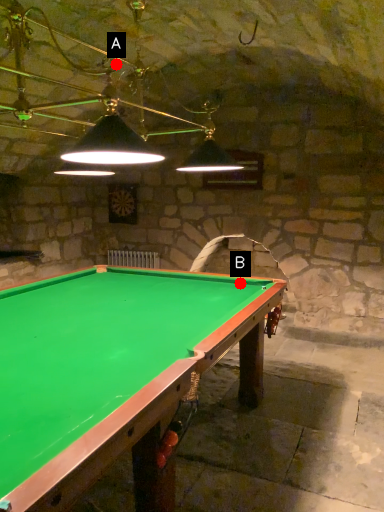
Question: Two points are circled on the image, labeled by A and B beside each circle. Which point appears closest to the camera in this image?

Choices:
 (A) A is closer
 (B) B is closer

Answer: (B)